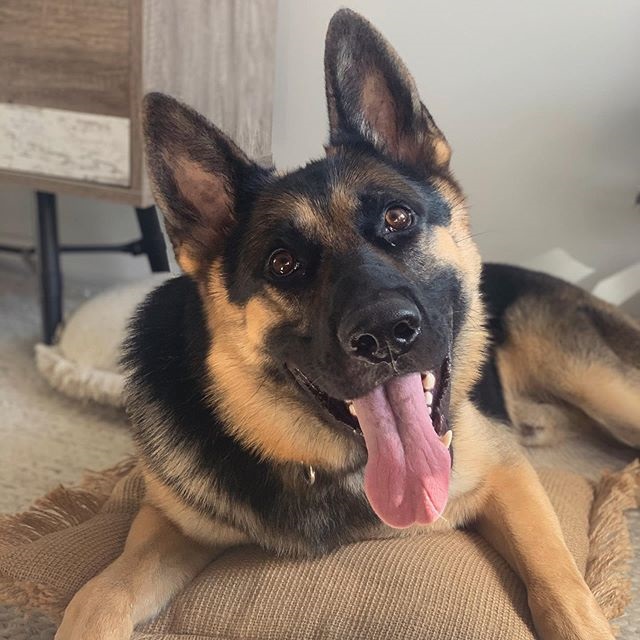
This screenshot has height=640, width=640. Identify the location of fringe on pillow. (61, 500).